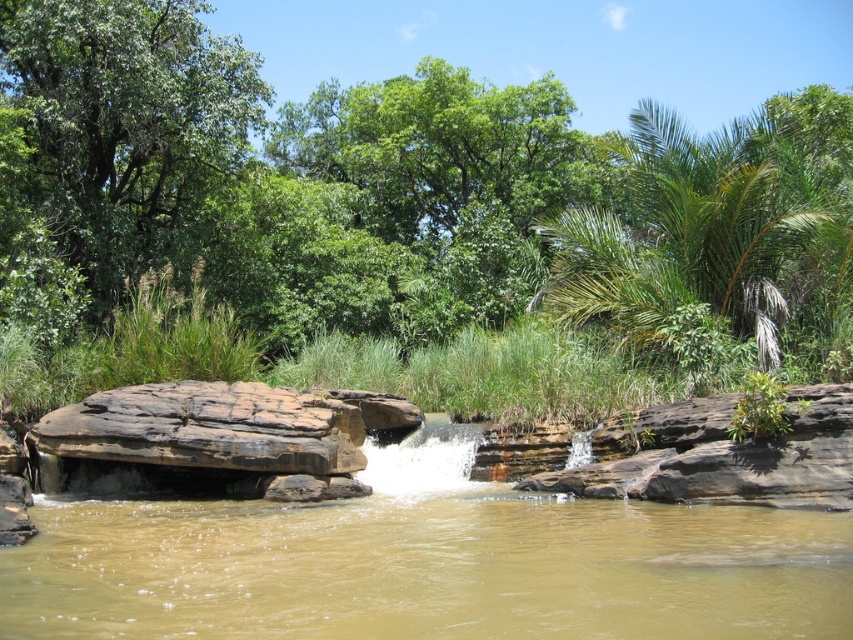
The height and width of the screenshot is (640, 853). I want to click on green leafy tree at center, so click(x=276, y=180).

Who is higher up, green leafy tree at center or brown rough rock at center?

green leafy tree at center

Between point (70, 13) and point (366, 397), which one is positioned behind?

Positioned behind is point (70, 13).

The width and height of the screenshot is (853, 640). In order to click on green leafy tree at center in this screenshot , I will do `click(276, 180)`.

Can you confirm if brown sedimentary rock at center is positioned to the left of green leafy palm at upper right?

Indeed, brown sedimentary rock at center is positioned on the left side of green leafy palm at upper right.

From the picture: Between brown sedimentary rock at center and green leafy palm at upper right, which one appears on the right side from the viewer's perspective?

Positioned to the right is green leafy palm at upper right.

Does point (704, 572) lie in front of point (805, 216)?

That is True.

Locate an element on the screen. The height and width of the screenshot is (640, 853). brown sedimentary rock at center is located at coordinates (427, 570).

Does green leafy tree at center have a smaller size compared to green leafy tree at upper left?

Actually, green leafy tree at center might be larger than green leafy tree at upper left.

Is point (131, 188) in front of point (91, 129)?

No, it is not.

What do you see at coordinates (276, 180) in the screenshot?
I see `green leafy tree at center` at bounding box center [276, 180].

The width and height of the screenshot is (853, 640). Find the location of `green leafy tree at center`. green leafy tree at center is located at coordinates (276, 180).